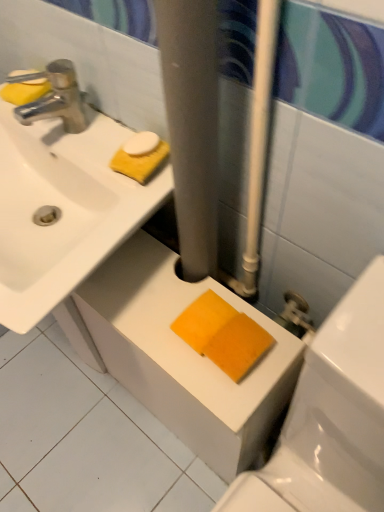
I want to click on free space in front of chrome metallic faucet at upper left, so click(97, 176).